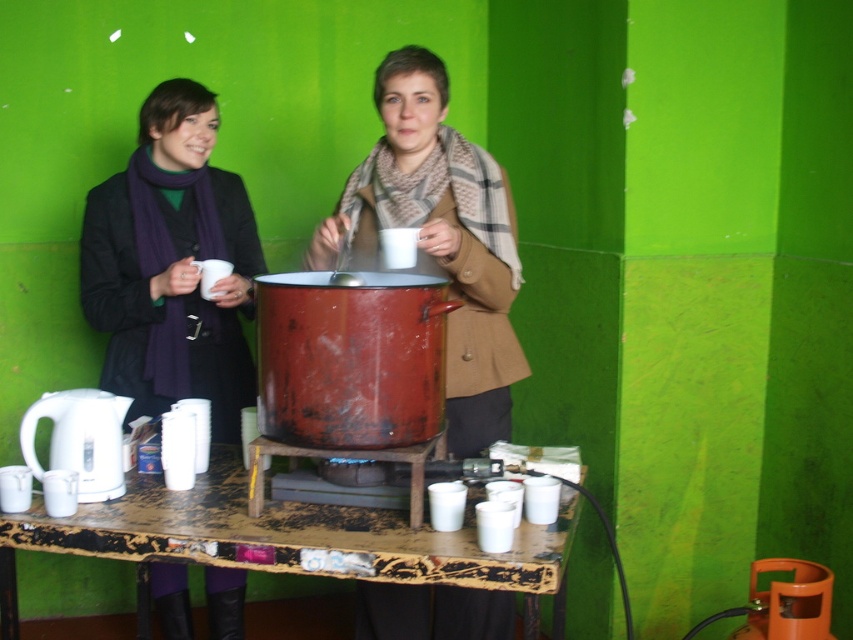
Question: Which point is closer to the camera?

Choices:
 (A) (167, 362)
 (B) (80, 460)

Answer: (B)

Question: Can you confirm if purple scarf at left is wider than white plastic kettle at lower left?

Choices:
 (A) no
 (B) yes

Answer: (B)

Question: Does plaid scarf at center appear under white plastic kettle at lower left?

Choices:
 (A) yes
 (B) no

Answer: (B)

Question: Among these points, which one is farthest from the camera?

Choices:
 (A) (367, 221)
 (B) (405, 538)
 (C) (132, 296)
 (D) (61, 444)

Answer: (C)

Question: Which object is the closest to the wooden table at center?

Choices:
 (A) plaid scarf at center
 (B) white plastic kettle at lower left
 (C) purple scarf at left

Answer: (B)

Question: Is purple scarf at left below wooden table at center?

Choices:
 (A) yes
 (B) no

Answer: (B)